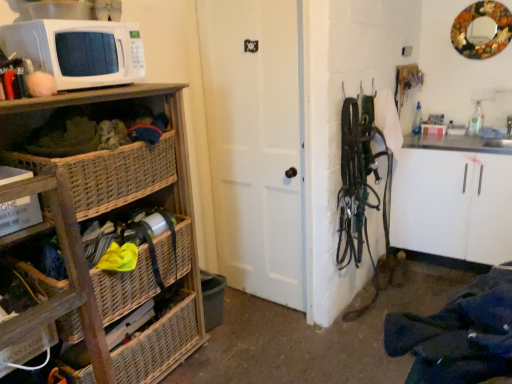
Question: From the image's perspective, is woven wood basket at left under woven wood basket at lower left, which is counted as the second basket, starting from the top?

Choices:
 (A) yes
 (B) no

Answer: (B)

Question: From the image's perspective, is woven wood basket at left above woven wood basket at lower left, which is counted as the second basket, starting from the top?

Choices:
 (A) yes
 (B) no

Answer: (A)

Question: Considering the relative positions of woven wood basket at left and woven wood basket at lower left, which is counted as the second basket, starting from the top, in the image provided, is woven wood basket at left to the left of woven wood basket at lower left, which is counted as the second basket, starting from the top, from the viewer's perspective?

Choices:
 (A) yes
 (B) no

Answer: (A)

Question: Does woven wood basket at left touch woven wood basket at lower left, which is counted as the second basket, starting from the top?

Choices:
 (A) yes
 (B) no

Answer: (B)

Question: Is woven wood basket at left closer to camera compared to woven wood basket at lower left, which is counted as the second basket, starting from the top?

Choices:
 (A) no
 (B) yes

Answer: (B)

Question: From their relative heights in the image, would you say woven wood basket at lower left, which is counted as the second basket, starting from the top, is taller or shorter than woven wood shelf at left?

Choices:
 (A) tall
 (B) short

Answer: (B)

Question: From the image's perspective, relative to woven wood shelf at left, is woven wood basket at lower left, the first basket positioned from the bottom, above or below?

Choices:
 (A) below
 (B) above

Answer: (A)

Question: Looking at their shapes, would you say woven wood basket at lower left, which is counted as the second basket, starting from the top, is wider or thinner than woven wood shelf at left?

Choices:
 (A) wide
 (B) thin

Answer: (B)

Question: In the image, is woven wood basket at lower left, which is counted as the second basket, starting from the top, positioned in front of or behind woven wood shelf at left?

Choices:
 (A) behind
 (B) front

Answer: (A)

Question: Is woven wood basket at left spatially inside woven wood basket at lower left, which is counted as the second basket, starting from the top, or outside of it?

Choices:
 (A) inside
 (B) outside

Answer: (B)

Question: In terms of size, does woven wood basket at left appear bigger or smaller than woven wood basket at lower left, the first basket positioned from the bottom?

Choices:
 (A) big
 (B) small

Answer: (B)

Question: From the image's perspective, is woven wood basket at left located above or below woven wood basket at lower left, the first basket positioned from the bottom?

Choices:
 (A) below
 (B) above

Answer: (B)

Question: From a real-world perspective, is woven wood basket at left physically located above or below woven wood basket at lower left, which is counted as the second basket, starting from the top?

Choices:
 (A) below
 (B) above

Answer: (B)

Question: In the image, is woven wood shelf at left positioned in front of or behind white matte microwave at upper left?

Choices:
 (A) front
 (B) behind

Answer: (A)

Question: Considering the positions of point (12, 192) and point (131, 77), is point (12, 192) closer or farther from the camera than point (131, 77)?

Choices:
 (A) farther
 (B) closer

Answer: (B)